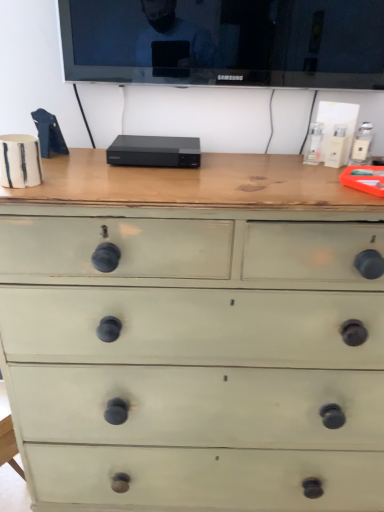
Question: Is point (16, 257) closer or farther from the camera than point (235, 44)?

Choices:
 (A) farther
 (B) closer

Answer: (B)

Question: From a real-world perspective, is green painted wood chest of drawers at center positioned above or below black glossy tv at upper center?

Choices:
 (A) below
 (B) above

Answer: (A)

Question: Considering the positions of green painted wood chest of drawers at center and black glossy tv at upper center in the image, is green painted wood chest of drawers at center wider or thinner than black glossy tv at upper center?

Choices:
 (A) wide
 (B) thin

Answer: (A)

Question: Looking at their shapes, would you say black glossy tv at upper center is wider or thinner than green painted wood chest of drawers at center?

Choices:
 (A) wide
 (B) thin

Answer: (B)

Question: Is black glossy tv at upper center bigger or smaller than green painted wood chest of drawers at center?

Choices:
 (A) big
 (B) small

Answer: (B)

Question: From a real-world perspective, is black glossy tv at upper center physically located above or below green painted wood chest of drawers at center?

Choices:
 (A) above
 (B) below

Answer: (A)

Question: Would you say black glossy tv at upper center is inside or outside green painted wood chest of drawers at center?

Choices:
 (A) inside
 (B) outside

Answer: (B)